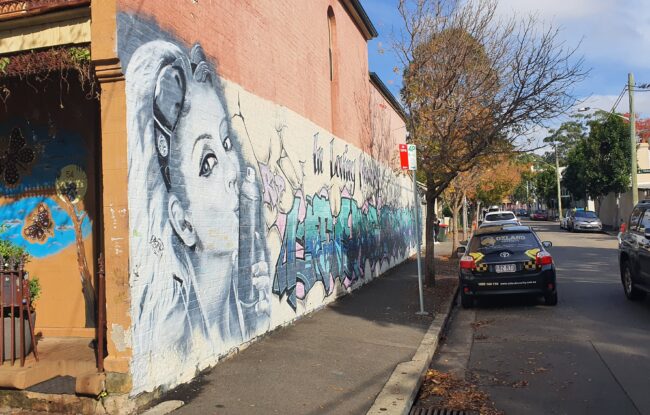
Locate an element on the screen. pot plant on the bottom left is located at coordinates (6, 327).